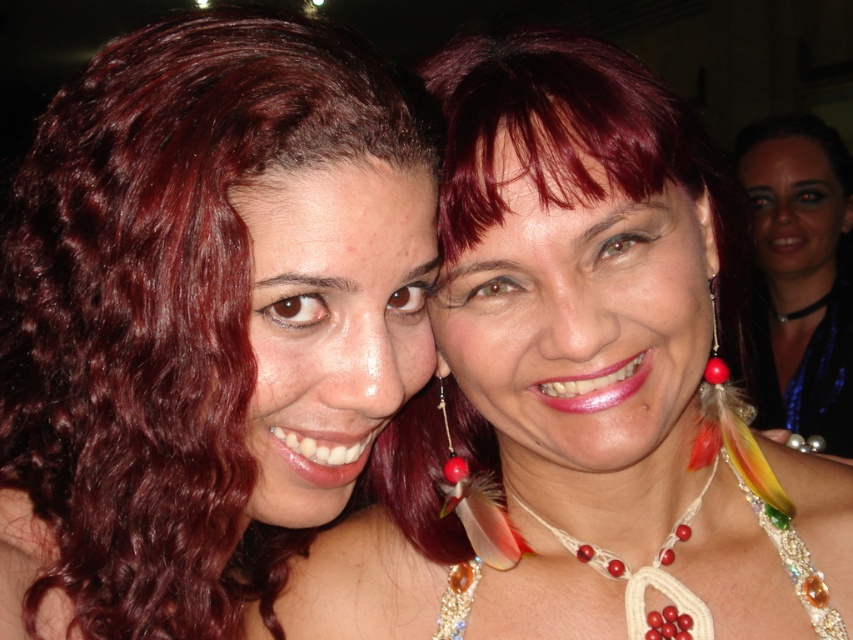
You are a photographer trying to adjust the lighting for a photo shoot. You notice the shiny red hair at upper left and the blue sequined dress at upper right. Which object would require more focused lighting to highlight its reflective properties?

The shiny red hair at upper left requires more focused lighting because it is shorter than the blue sequined dress at upper right, making it smaller and thus needing concentrated light to emphasize its reflective qualities.

You are a photographer adjusting the lighting for a portrait. You notice the satin blue scarf at upper right in the frame. Where should you position the key light to ensure it illuminates the scarf effectively?

The satin blue scarf at upper right is located at point (799, 275), so position the key light slightly to the right and above the scarf to cast light directly onto it.